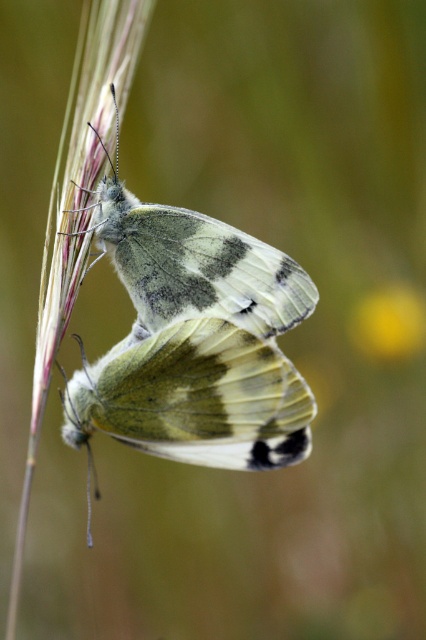
Does point (298, 264) come closer to viewer compared to point (411, 320)?

Yes.

Locate an element on the screen. The width and height of the screenshot is (426, 640). translucent white wings at center is located at coordinates [192, 262].

Between point (161, 396) and point (385, 316), which one is positioned in front?

Positioned in front is point (161, 396).

How much distance is there between translucent green wings at center and yellow matte flower at upper right?

The distance of translucent green wings at center from yellow matte flower at upper right is 86.35 centimeters.

This screenshot has height=640, width=426. What do you see at coordinates (192, 400) in the screenshot? I see `translucent green wings at center` at bounding box center [192, 400].

The height and width of the screenshot is (640, 426). What are the coordinates of `translucent green wings at center` in the screenshot? It's located at (192, 400).

How distant is translucent green wings at center from translucent white wings at center?

A distance of 5.97 inches exists between translucent green wings at center and translucent white wings at center.

Which is below, translucent green wings at center or translucent white wings at center?

Positioned lower is translucent green wings at center.

Describe the element at coordinates (192, 400) in the screenshot. I see `translucent green wings at center` at that location.

Identify the location of translucent green wings at center. The width and height of the screenshot is (426, 640). (192, 400).